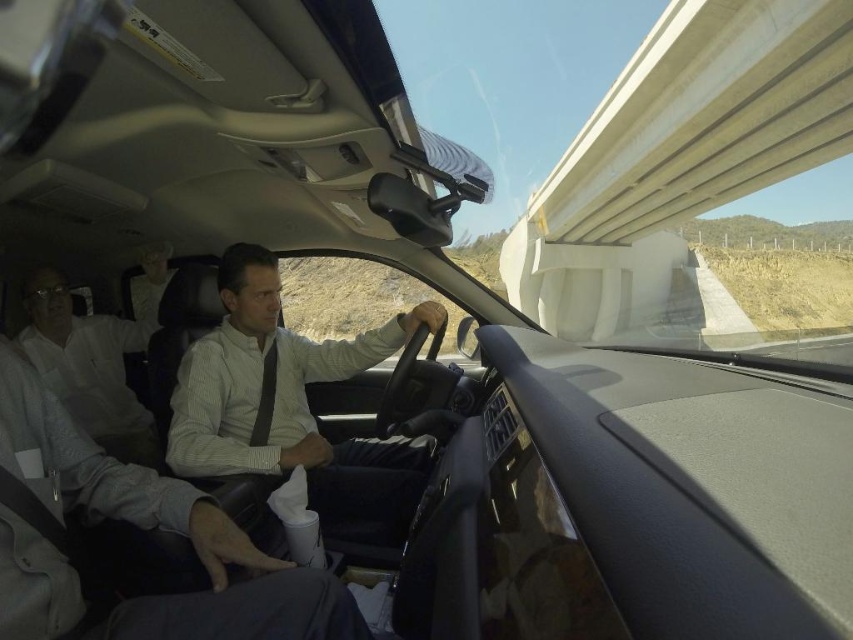
Can you confirm if white striped shirt at center is bigger than matte black tie at center?

Correct, white striped shirt at center is larger in size than matte black tie at center.

Can you confirm if white striped shirt at center is positioned to the left of matte black tie at center?

In fact, white striped shirt at center is to the right of matte black tie at center.

Does point (206, 392) come farther from viewer compared to point (256, 429)?

That is False.

Identify the location of white striped shirt at center. (292, 403).

Can you confirm if white shirt at left is smaller than matte black tie at center?

Actually, white shirt at left might be larger than matte black tie at center.

Does point (97, 356) come farther from viewer compared to point (270, 360)?

Yes, it is.

Where is `white shirt at left`? white shirt at left is located at coordinates (90, 365).

Image resolution: width=853 pixels, height=640 pixels. Describe the element at coordinates (292, 403) in the screenshot. I see `white striped shirt at center` at that location.

Can you confirm if white striped shirt at center is taller than white shirt at left?

Yes, white striped shirt at center is taller than white shirt at left.

What are the coordinates of `white striped shirt at center` in the screenshot? It's located at (292, 403).